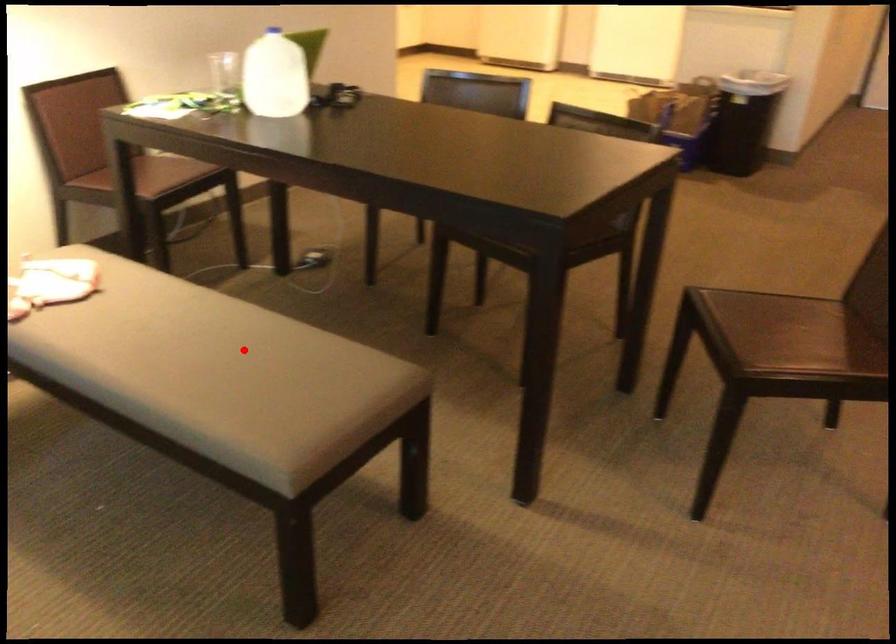
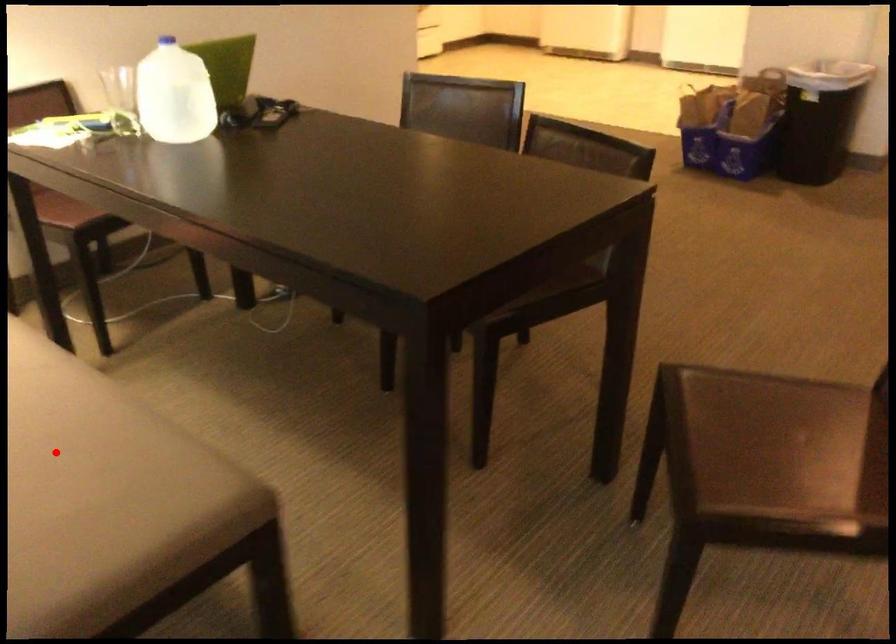
I am providing you with two images of the same scene from different viewpoints. A red point is marked on the first image and another point is marked on the second image. Does the point marked in image1 correspond to the same location as the one in image2?

Yes